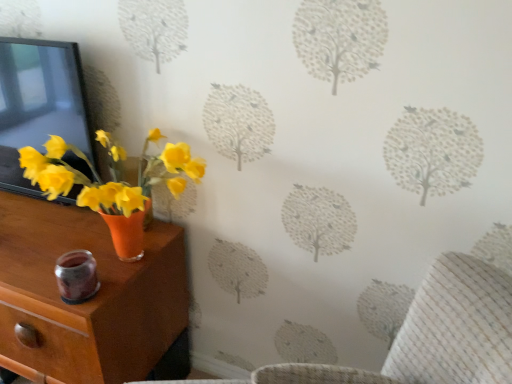
Locate an element on the screen. The height and width of the screenshot is (384, 512). free space in front of matte black picture frame at left is located at coordinates (33, 228).